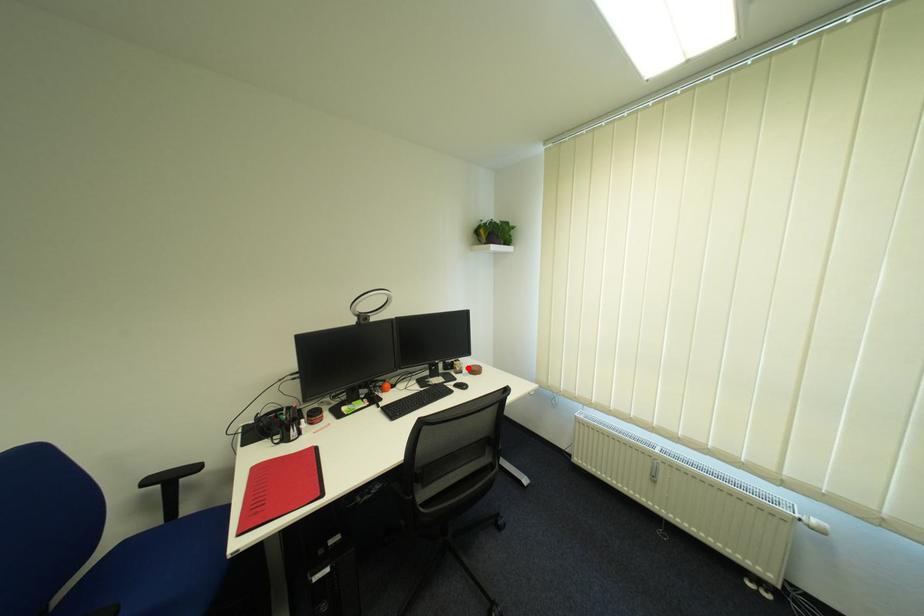
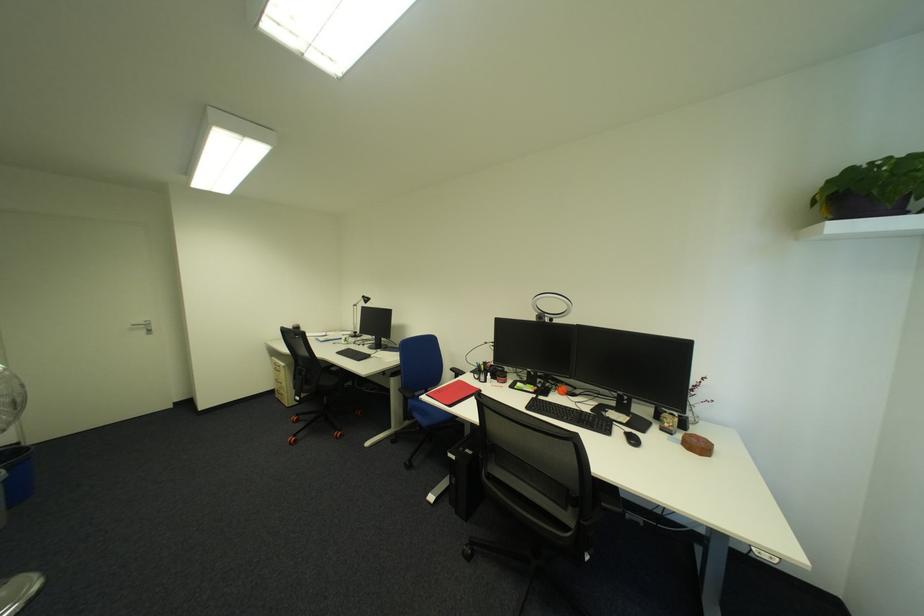
In the second image, find the point that corresponds to the highlighted location in the first image.

(677, 424)